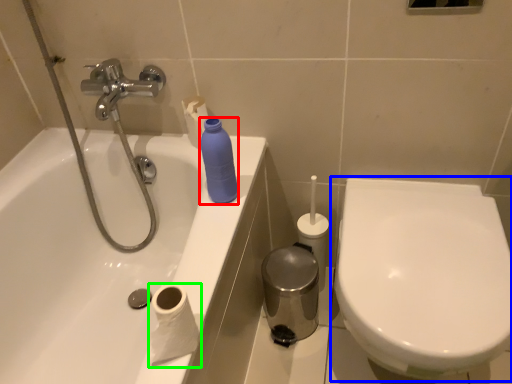
Question: Based on their relative distances, which object is nearer to cleaning product (highlighted by a red box)? Choose from toilet (highlighted by a blue box) and toilet paper (highlighted by a green box).

Choices:
 (A) toilet
 (B) toilet paper

Answer: (B)